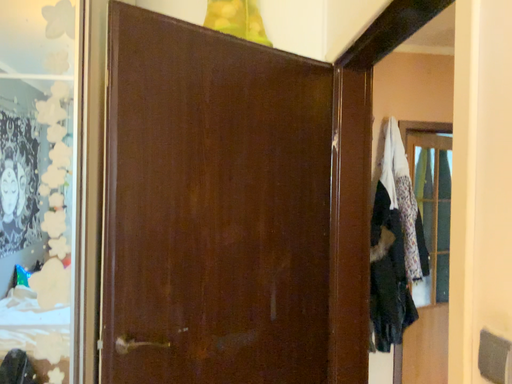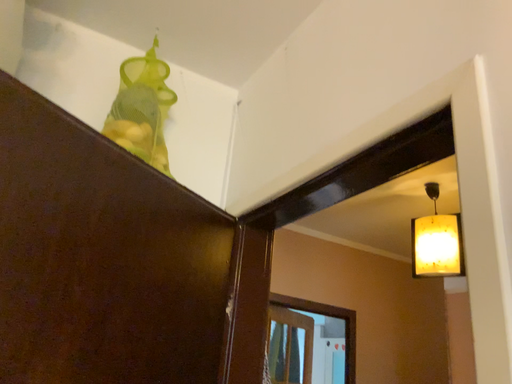
Question: How did the camera likely rotate when shooting the video?

Choices:
 (A) rotated upward
 (B) rotated downward

Answer: (A)